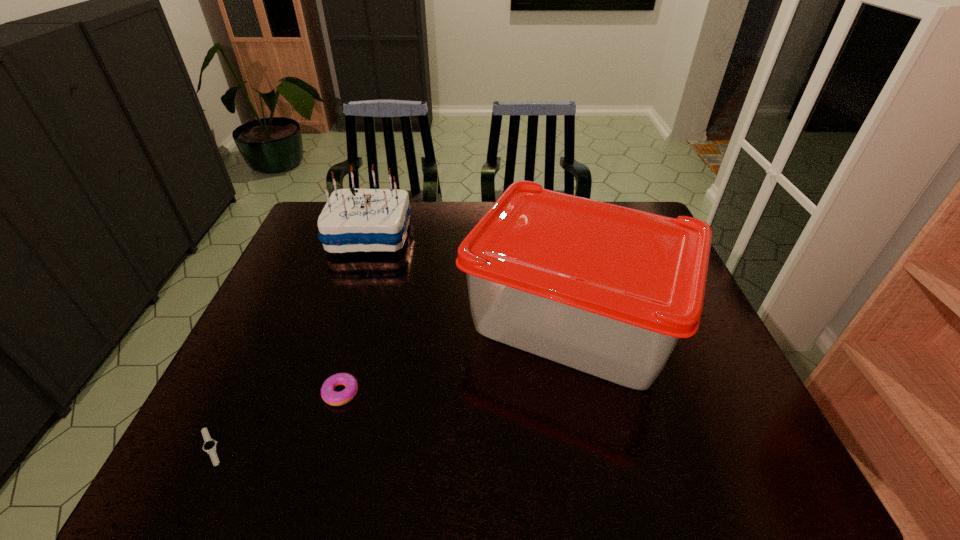
This screenshot has width=960, height=540. I want to click on the third closest object to the third tallest object, so pos(353,220).

Identify which object is the third closest to the third tallest object. Please provide its 2D coordinates. Your answer should be formatted as a tuple, i.e. [(x, y)], where the tuple contains the x and y coordinates of a point satisfying the conditions above.

[(353, 220)]

You are a GUI agent. You are given a task and a screenshot of the screen. Output one action in this format:
    pyautogui.click(x=<x>, y=<y>)
    Task: Click on the free space that satisfies the following two spatial constraints: 1. on the back side of the nearest object; 2. on the right side of the birthday cake
    
    Given the screenshot: What is the action you would take?
    pyautogui.click(x=313, y=235)

Find the location of a particular element. Image resolution: width=960 pixels, height=540 pixels. vacant space that satisfies the following two spatial constraints: 1. on the back side of the birthday cake; 2. on the right side of the leftmost object is located at coordinates coord(313,235).